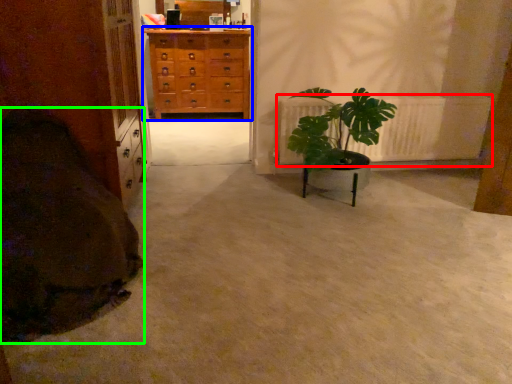
Question: Which object is the closest to the radiator (highlighted by a red box)? Choose among these: chest of drawers (highlighted by a blue box) or blanket (highlighted by a green box).

Choices:
 (A) chest of drawers
 (B) blanket

Answer: (B)